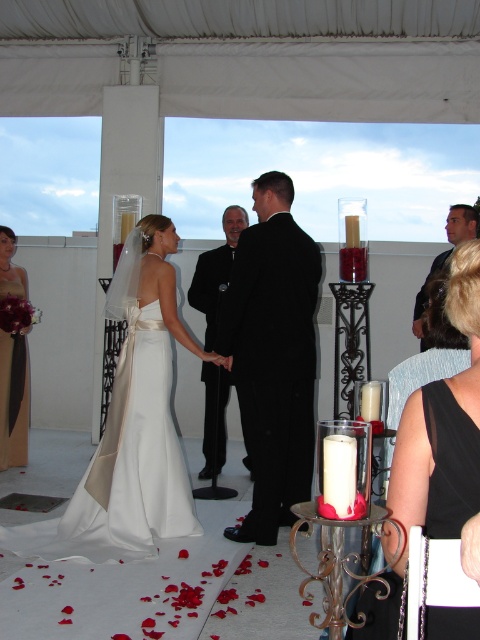
Question: Which is farther from the satin/crepe dress at center?

Choices:
 (A) black satin suit at center
 (B) silky satin dress at left
 (C) black smooth suit at center

Answer: (B)

Question: Which point is closer to the camera taking this photo?

Choices:
 (A) (405, 426)
 (B) (296, 448)
 (C) (144, 506)
 (D) (417, 323)

Answer: (A)

Question: Is black satin suit at center bigger than black satin dress at lower right?

Choices:
 (A) yes
 (B) no

Answer: (A)

Question: Which point is closer to the camera?

Choices:
 (A) (120, 468)
 (B) (288, 433)

Answer: (A)

Question: Is satin/crepe dress at center below black satin suit at center?

Choices:
 (A) yes
 (B) no

Answer: (A)

Question: Is the position of silky satin dress at left less distant than that of black satin suit at right?

Choices:
 (A) yes
 (B) no

Answer: (B)